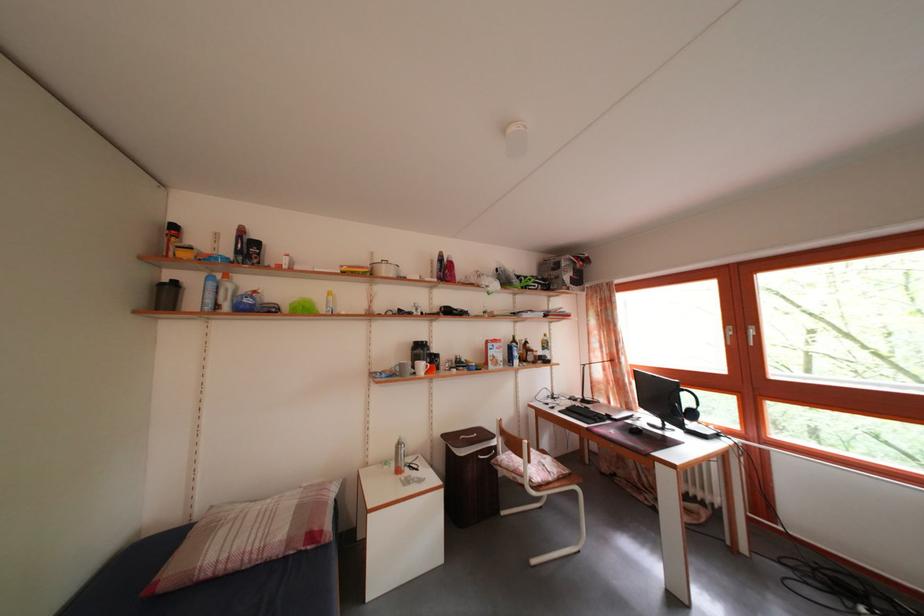
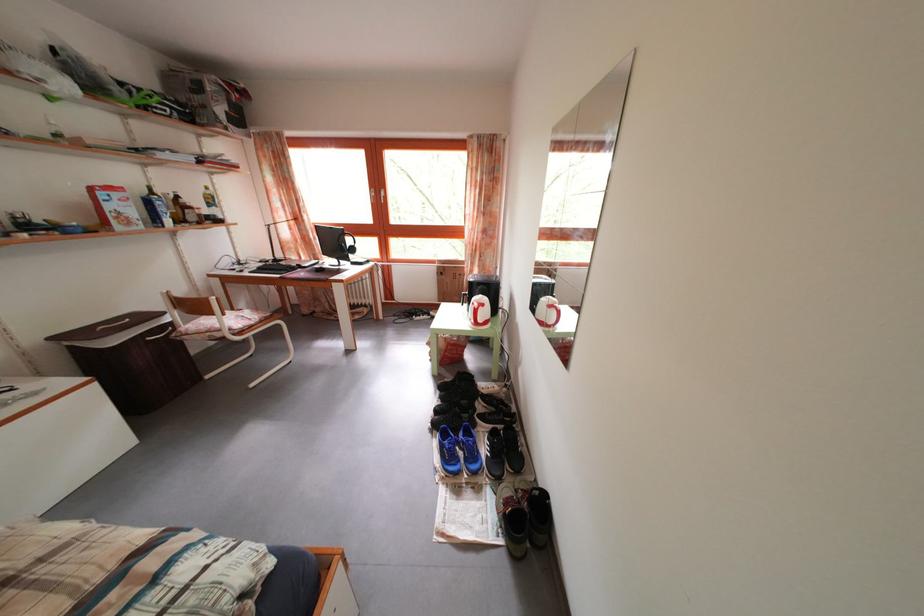
The images are taken continuously from a first-person perspective. In which direction is your viewpoint rotating?

The camera rotated toward right-down.